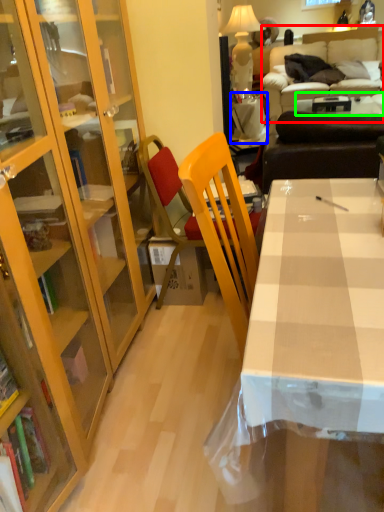
Question: Which is farther away from studio couch (highlighted by a red box)? table (highlighted by a blue box) or table (highlighted by a green box)?

Choices:
 (A) table
 (B) table

Answer: (A)